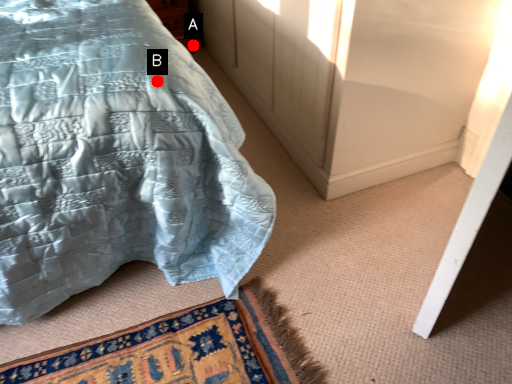
Question: Two points are circled on the image, labeled by A and B beside each circle. Among these points, which one is nearest to the camera?

Choices:
 (A) A is closer
 (B) B is closer

Answer: (B)